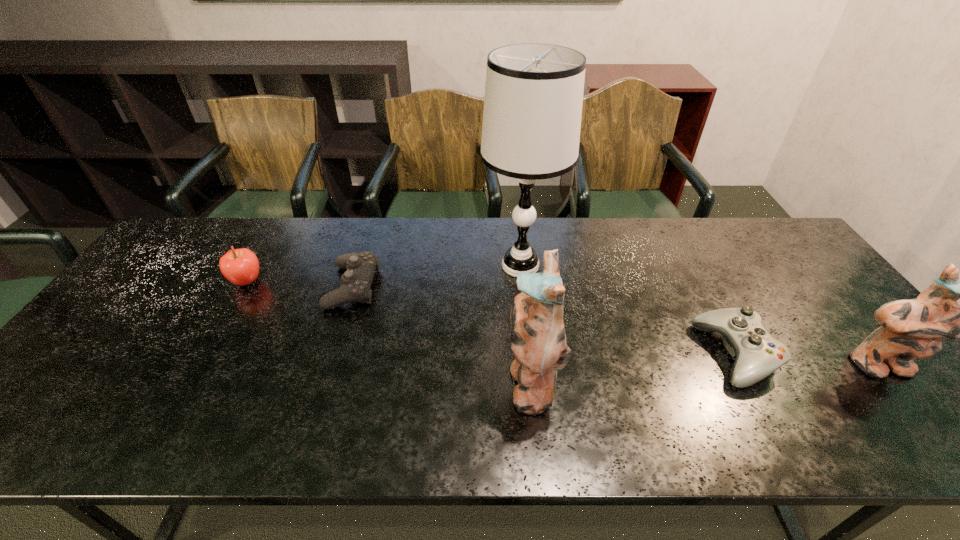
Image resolution: width=960 pixels, height=540 pixels. I want to click on the left figurine, so click(x=538, y=338).

Find the location of a particular element. the taller figurine is located at coordinates (538, 338).

You are a GUI agent. You are given a task and a screenshot of the screen. Output one action in this format:
    pyautogui.click(x=<x>, y=<y>)
    Task: Click on the third tallest object
    The width and height of the screenshot is (960, 540).
    Given the screenshot: What is the action you would take?
    pyautogui.click(x=911, y=328)

Identify the location of the right figurine. (911, 328).

This screenshot has width=960, height=540. What are the coordinates of `table lamp` in the screenshot? It's located at (533, 100).

You are a GUI agent. You are given a task and a screenshot of the screen. Output one action in this format:
    pyautogui.click(x=<x>, y=<y>)
    Task: Click on the farther control
    Image resolution: width=960 pixels, height=540 pixels.
    Given the screenshot: What is the action you would take?
    pyautogui.click(x=360, y=267)

You are a GUI agent. You are given a task and a screenshot of the screen. Output one action in this format:
    pyautogui.click(x=<x>, y=<y>)
    Task: Click on the fifth object from right to left
    
    Given the screenshot: What is the action you would take?
    pyautogui.click(x=360, y=267)

Image resolution: width=960 pixels, height=540 pixels. Find the location of `the leftmost object`. the leftmost object is located at coordinates (240, 266).

Identify the location of apple. The height and width of the screenshot is (540, 960). (240, 266).

Image resolution: width=960 pixels, height=540 pixels. I want to click on the second object from right to left, so [758, 354].